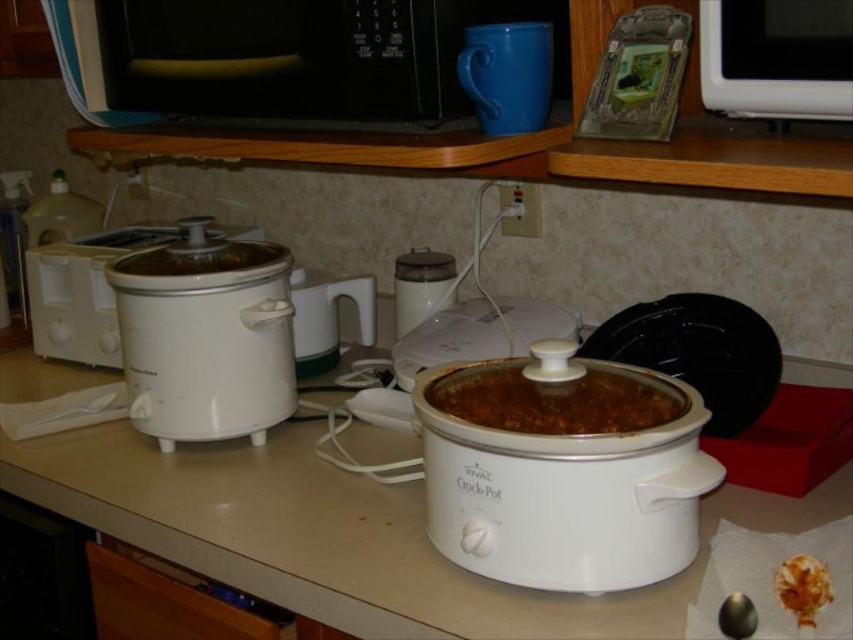
You are standing in front of the kitchen countertop scene. There are two points marked on the image, one at coordinates point (293, 10) and the other at point (827, 598). Which point is closer to you?

Point (293, 10) is further to the camera than point (827, 598). Therefore, point (827, 598) is closer to you.

You are preparing to place a new dish on the kitchen countertop. The white matte slow cooker at left and the brown crumbly food at lower right are already there. Which object occupies more space on the countertop?

The white matte slow cooker at left occupies more space on the countertop because it is larger in size compared to the brown crumbly food at lower right.